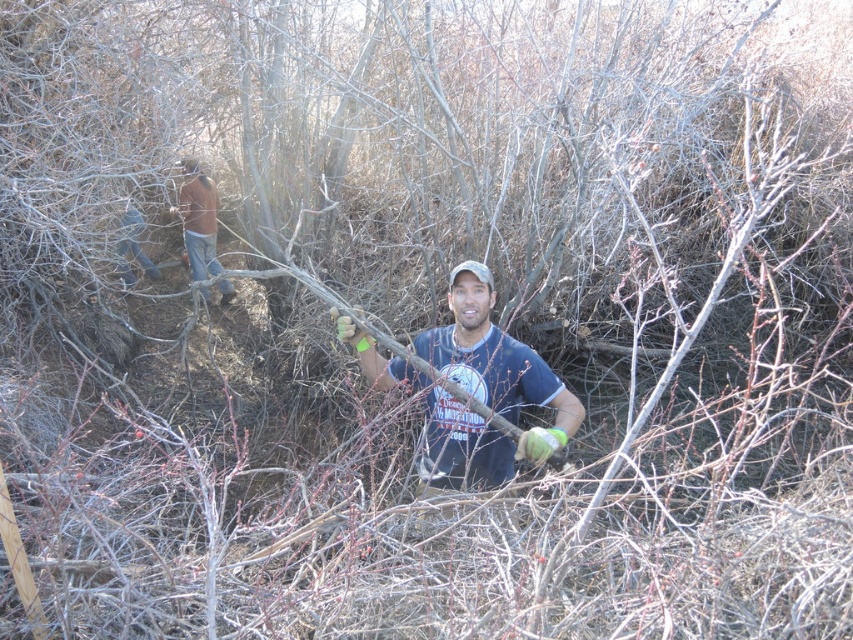
Question: Which object is positioned farthest from the brown leather jacket at upper left?

Choices:
 (A) dark blue t-shirt at center
 (B) denim jeans at left

Answer: (A)

Question: Can you confirm if dark blue t-shirt at center is positioned below denim jeans at left?

Choices:
 (A) yes
 (B) no

Answer: (A)

Question: Which point is farther to the camera?

Choices:
 (A) brown leather jacket at upper left
 (B) dark blue t-shirt at center
 (C) denim jeans at left

Answer: (A)

Question: Which point is closer to the camera taking this photo?

Choices:
 (A) (556, 394)
 (B) (125, 244)
 (C) (215, 236)

Answer: (A)

Question: Can you confirm if brown leather jacket at upper left is positioned below denim jeans at left?

Choices:
 (A) no
 (B) yes

Answer: (A)

Question: Observing the image, what is the correct spatial positioning of dark blue t-shirt at center in reference to denim jeans at left?

Choices:
 (A) below
 (B) above

Answer: (A)